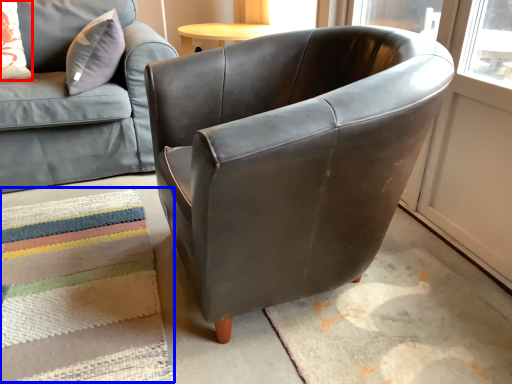
Question: Among these objects, which one is nearest to the camera, pillow (highlighted by a red box) or mat (highlighted by a blue box)?

Choices:
 (A) pillow
 (B) mat

Answer: (B)